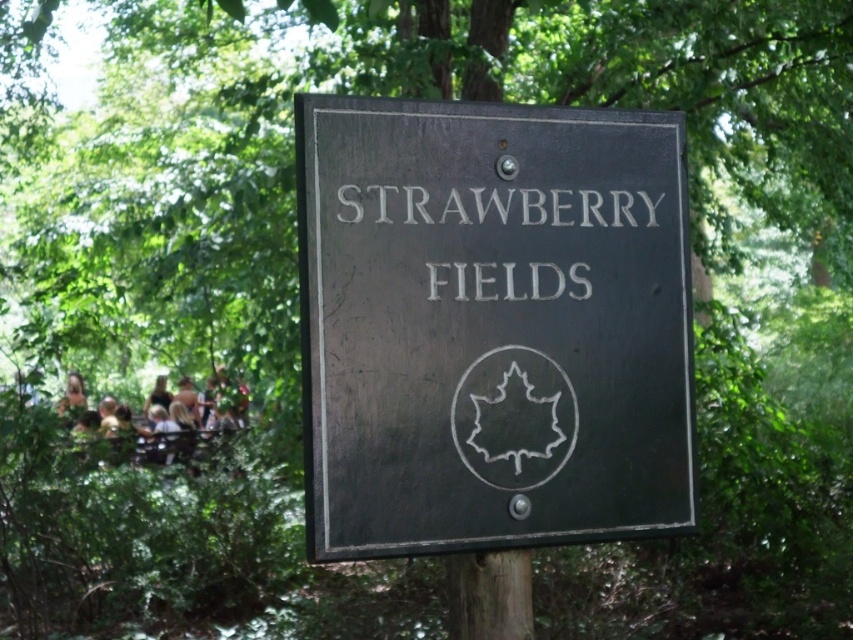
In the scene shown: You are standing in a park and see the matte black sign at center. If you want to reach the sign, which direction should you walk from your current position?

Since the matte black sign at center is located at coordinates point (490, 324), you should walk directly towards it as it is centrally positioned in the park.

You are designing a layout for a new sign and need to ensure the text fits within the sign. Given the matte black sign at center and the white painted text at center, which one is wider?

The matte black sign at center is wider than the white painted text at center.